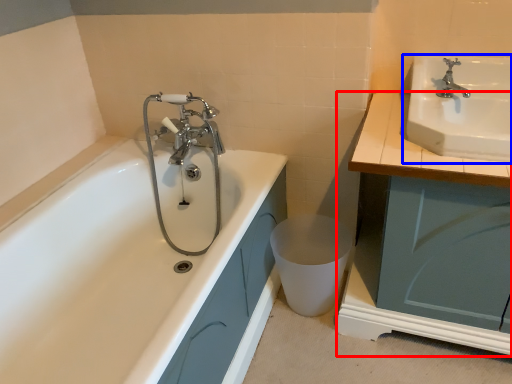
Question: Which of the following is the farthest to the observer, cabinetry (highlighted by a red box) or sink (highlighted by a blue box)?

Choices:
 (A) cabinetry
 (B) sink

Answer: (B)